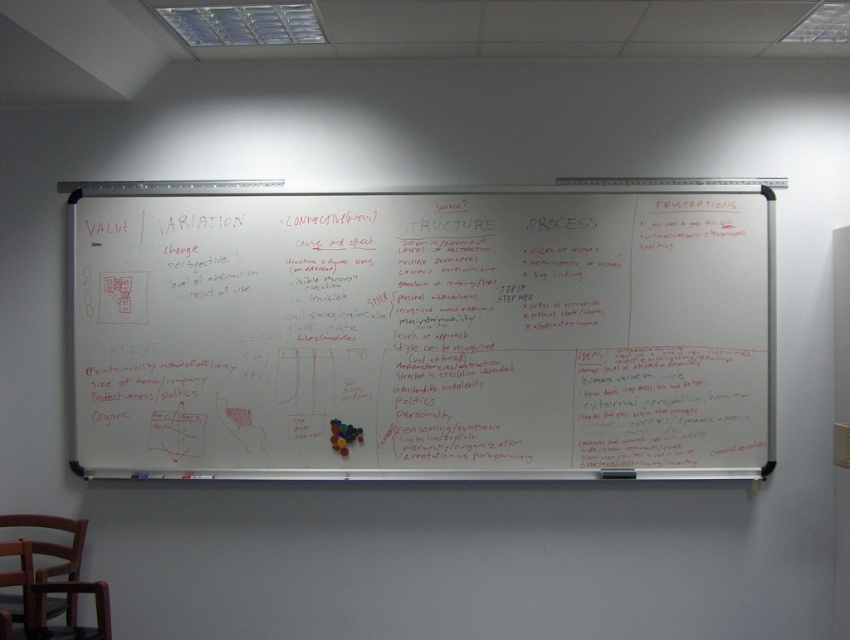
In the scene shown: Can you confirm if whiteboard at center is wider than brown wooden chair at lower left?

Yes.

I want to click on whiteboard at center, so click(x=423, y=333).

The height and width of the screenshot is (640, 850). I want to click on whiteboard at center, so click(423, 333).